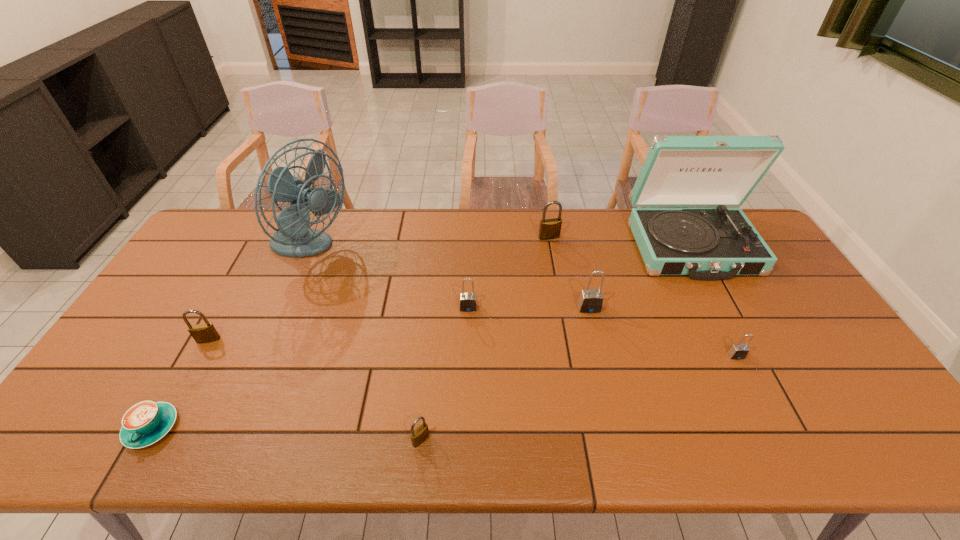
Image resolution: width=960 pixels, height=540 pixels. In order to click on vacant area that lies between the fifth object from left to right and the turquoise cappuccino in this screenshot , I will do `click(310, 368)`.

Image resolution: width=960 pixels, height=540 pixels. I want to click on vacant region between the fifth object from right to left and the smallest gray padlock, so click(602, 332).

Where is `empty location between the fan and the sixth object from right to left`? The width and height of the screenshot is (960, 540). empty location between the fan and the sixth object from right to left is located at coordinates (365, 345).

The width and height of the screenshot is (960, 540). What are the coordinates of `free spot between the leftmost brass padlock and the shortest object` in the screenshot? It's located at (180, 383).

Locate an element on the screen. free space between the fourth padlock from left to right and the fifth object from left to right is located at coordinates (509, 273).

Locate an element on the screen. This screenshot has height=540, width=960. free space between the fan and the second biggest gray padlock is located at coordinates (389, 279).

Identify which object is the closest to the seventh object from left to right. Please provide its 2D coordinates. Your answer should be formatted as a tuple, i.e. [(x, y)], where the tuple contains the x and y coordinates of a point satisfying the conditions above.

[(717, 243)]

Choose which object is the sixth nearest neighbor to the blue record player. Please provide its 2D coordinates. Your answer should be formatted as a tuple, i.e. [(x, y)], where the tuple contains the x and y coordinates of a point satisfying the conditions above.

[(294, 238)]

In order to click on padlock that is the closest to the second brass padlock from right to left in this screenshot , I will do [x=468, y=301].

Locate an element on the screen. Image resolution: width=960 pixels, height=540 pixels. padlock that is the second closest to the second gray padlock from right to left is located at coordinates (549, 229).